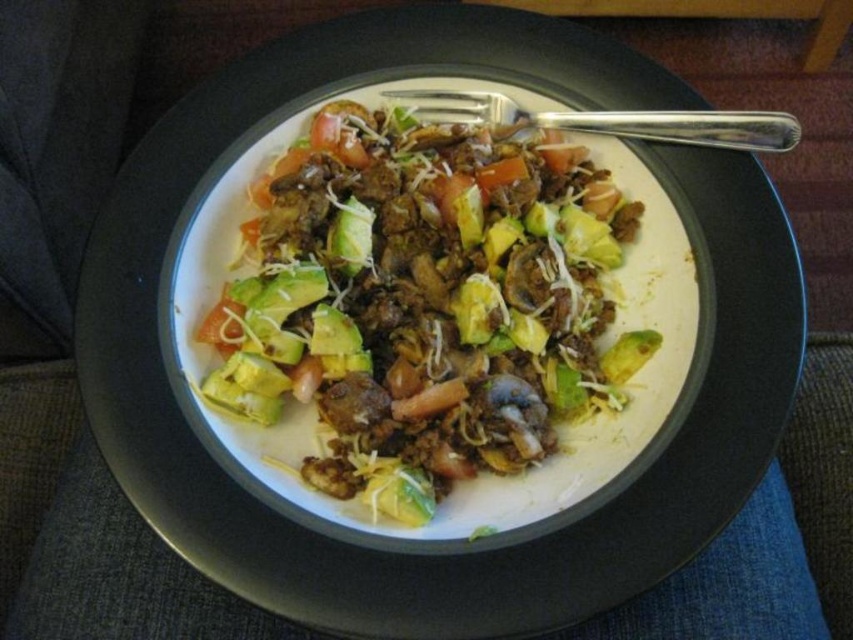
Question: Does shiny avocado salad at center appear over green avocado at center?

Choices:
 (A) yes
 (B) no

Answer: (B)

Question: Can you confirm if satin silver fork at upper right is positioned below green avocado at center?

Choices:
 (A) yes
 (B) no

Answer: (B)

Question: Considering the real-world distances, which object is farthest from the satin silver fork at upper right?

Choices:
 (A) shiny avocado salad at center
 (B) green avocado at center

Answer: (B)

Question: Which point appears farthest from the camera in this image?

Choices:
 (A) (345, 243)
 (B) (531, 474)
 (C) (784, 131)

Answer: (A)

Question: Observing the image, what is the correct spatial positioning of satin silver fork at upper right in reference to green avocado at center?

Choices:
 (A) left
 (B) right

Answer: (B)

Question: Which point is farther to the camera?

Choices:
 (A) shiny avocado salad at center
 (B) green avocado at center
 (C) satin silver fork at upper right

Answer: (B)